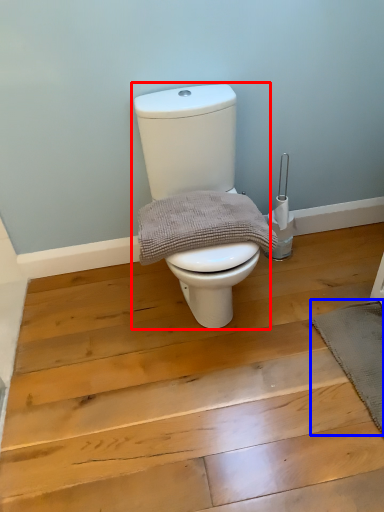
Question: Which object is closer to the camera taking this photo, toilet (highlighted by a red box) or bath mat (highlighted by a blue box)?

Choices:
 (A) toilet
 (B) bath mat

Answer: (A)